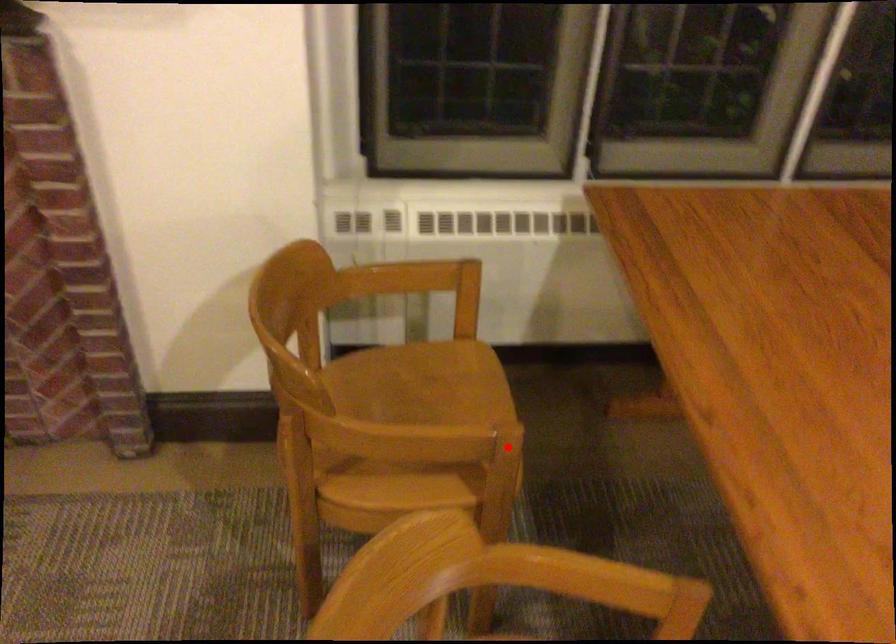
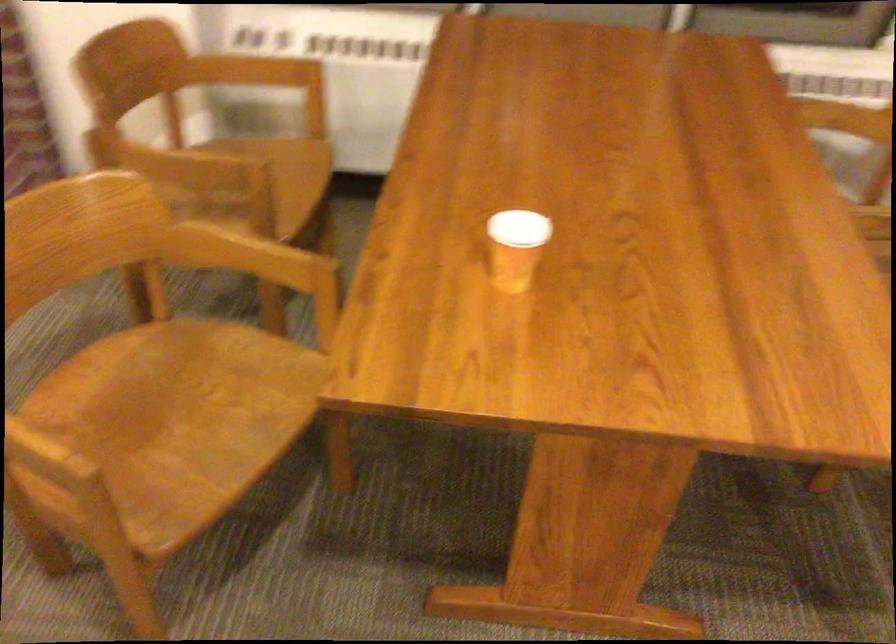
Question: I am providing you with two images of the same scene from different viewpoints. In image1, a red point is highlighted. Considering the same 3D point in image2, which of the following is correct?

Choices:
 (A) It is closer
 (B) It is farther

Answer: (B)